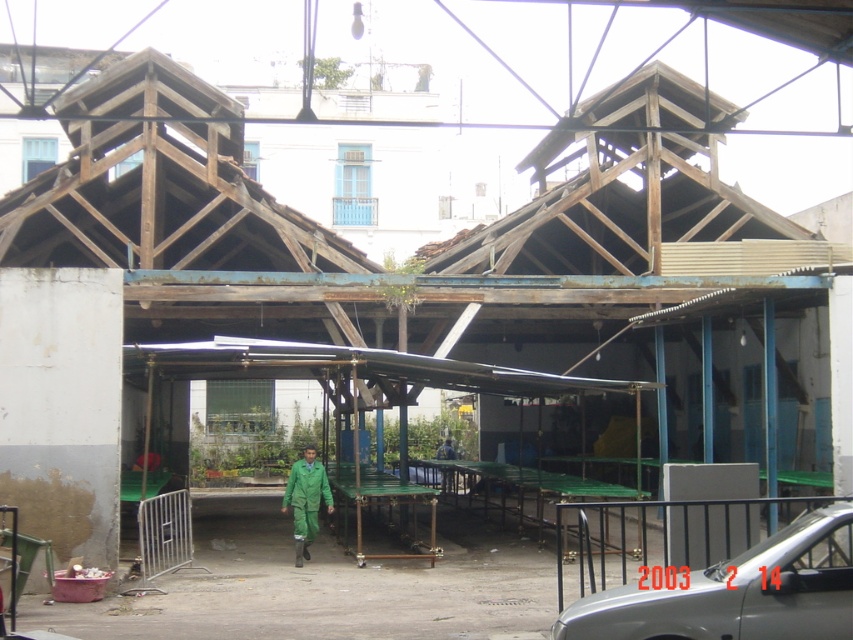
Is silver metallic car at lower right to the right of green matte jumpsuit at center from the viewer's perspective?

Indeed, silver metallic car at lower right is positioned on the right side of green matte jumpsuit at center.

Does silver metallic car at lower right have a greater height compared to green matte jumpsuit at center?

Indeed, silver metallic car at lower right has a greater height compared to green matte jumpsuit at center.

Does point (718, 634) come behind point (302, 556)?

No, it is not.

This screenshot has width=853, height=640. Identify the location of silver metallic car at lower right. (714, 573).